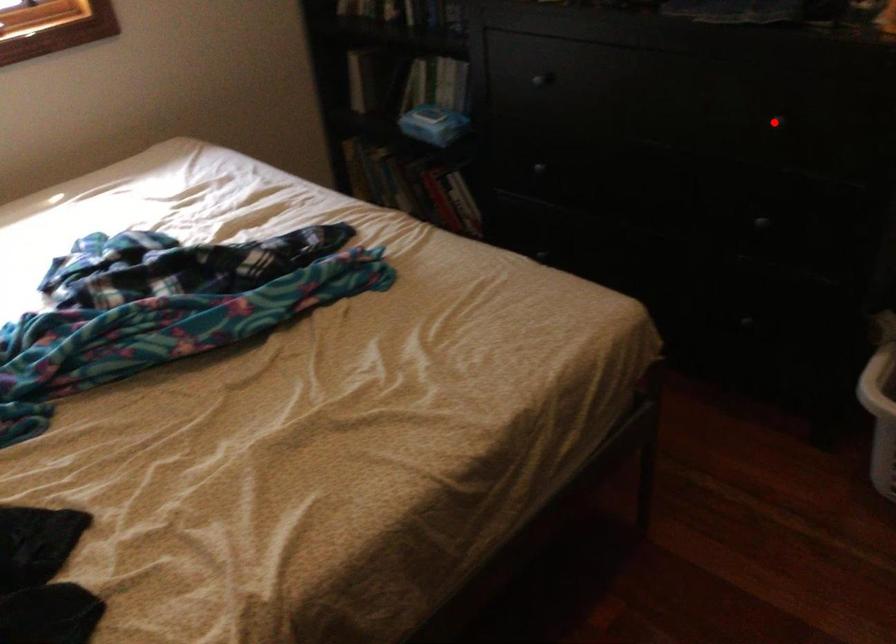
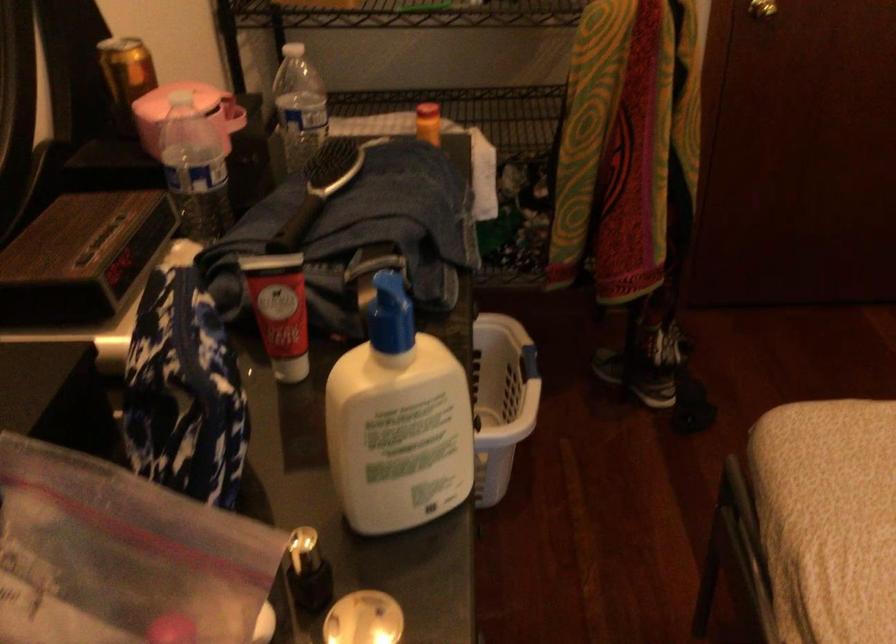
Question: I am providing you with two images of the same scene from different viewpoints. A red point is marked on the first image. At the location where the point appears in image 1, is it still visible in image 2?

Choices:
 (A) Yes
 (B) No

Answer: (B)